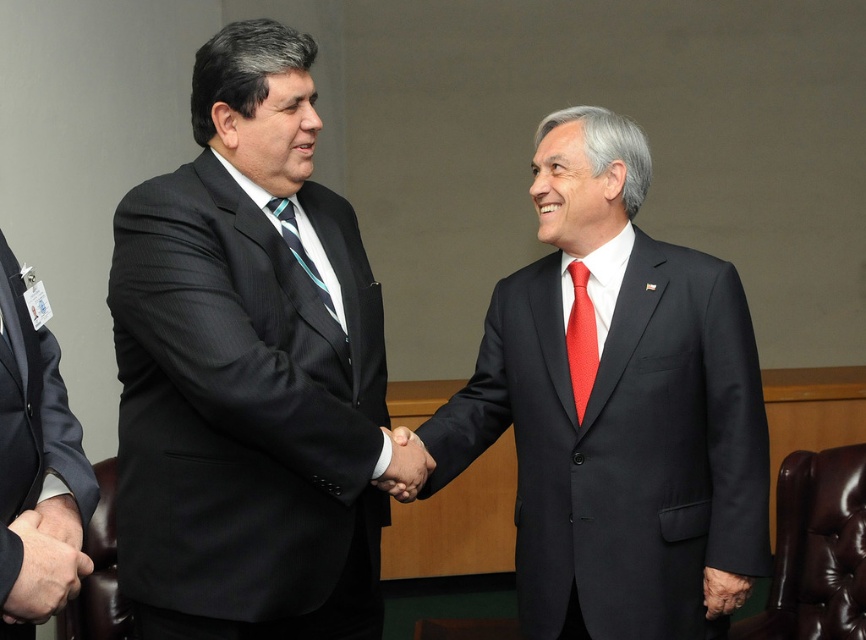
Looking at this image, you are a photographer positioned in front of the two men shaking hands. You need to adjust your camera focus to capture the matte black suit at right and the red satin tie at center clearly. Which object should you focus on first to ensure it appears sharp in the photo?

The matte black suit at right is closer to the viewer than the red satin tie at center, so you should focus on the matte black suit at right first to ensure it appears sharp. Since the red satin tie at center is farther away, adjusting focus from near to far will help both objects be in focus.

You are standing at the entrance of the conference room and see two points in the scene. The first point is labeled as point (x=253, y=465) and the second is point (x=578, y=301). Which point is closer to you?

Point (x=253, y=465) is closer to the viewer than point (x=578, y=301).